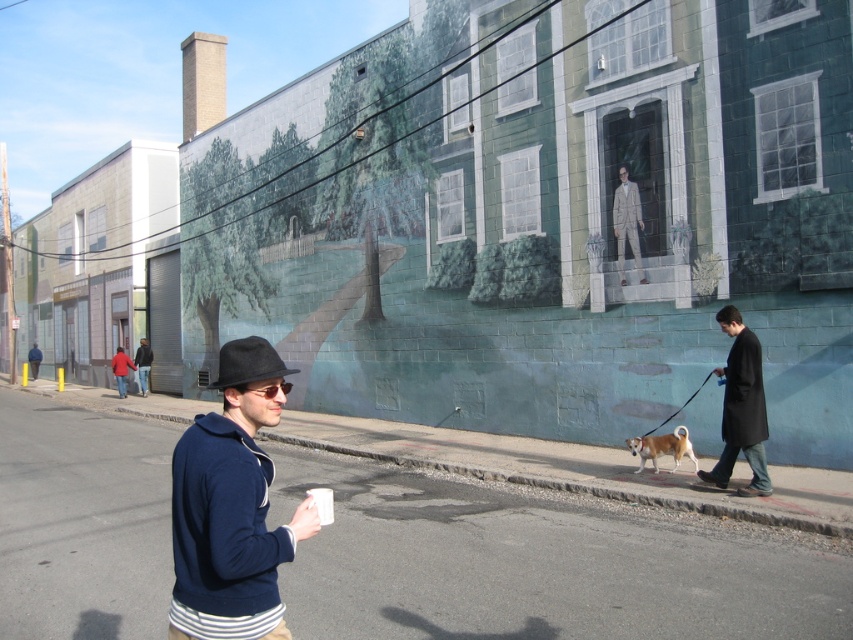
Is point (743, 356) closer to camera compared to point (692, 461)?

Yes, point (743, 356) is closer to viewer.

The image size is (853, 640). Find the location of `black wool coat at right`. black wool coat at right is located at coordinates (741, 406).

Is point (753, 372) positioned in front of point (672, 445)?

Yes, point (753, 372) is closer to viewer.

Locate an element on the screen. The width and height of the screenshot is (853, 640). black wool coat at right is located at coordinates (741, 406).

Can you confirm if matte black hat at center is positioned to the right of dark blue sweater at center?

Correct, you'll find matte black hat at center to the right of dark blue sweater at center.

How much distance is there between matte black hat at center and dark blue sweater at center?

The distance of matte black hat at center from dark blue sweater at center is 81.26 feet.

Image resolution: width=853 pixels, height=640 pixels. I want to click on matte black hat at center, so click(x=231, y=506).

Between light beige suit at center and dark blue sweater at center, which one has less height?

light beige suit at center

Is light beige suit at center below dark blue sweater at center?

No.

Where is `light beige suit at center`? This screenshot has width=853, height=640. light beige suit at center is located at coordinates (627, 224).

Locate an element on the screen. This screenshot has height=640, width=853. light beige suit at center is located at coordinates (627, 224).